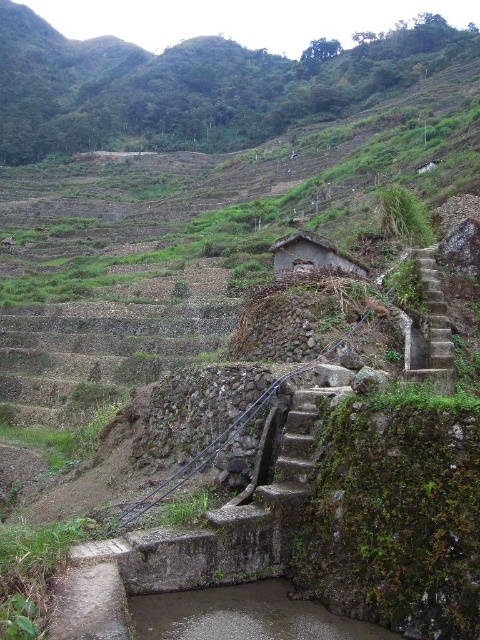
Does green mossy stone stairs at right have a greater height compared to rustic stone hut at center?

Indeed, green mossy stone stairs at right has a greater height compared to rustic stone hut at center.

You are a GUI agent. You are given a task and a screenshot of the screen. Output one action in this format:
    pyautogui.click(x=<x>, y=<y>)
    Task: Click on the green mossy stone stairs at right
    The height and width of the screenshot is (640, 480).
    Given the screenshot: What is the action you would take?
    pyautogui.click(x=432, y=328)